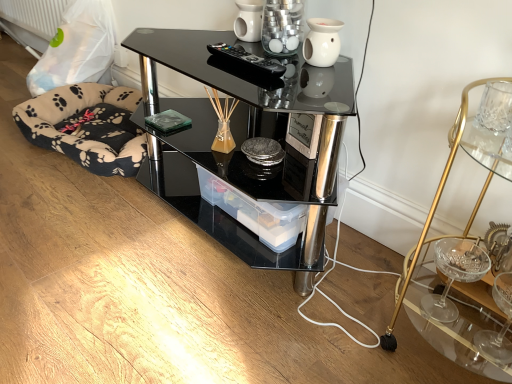
Measure the distance between white ceramic vase at upper center and camera.

1.06 meters.

What do you see at coordinates (322, 42) in the screenshot?
I see `white ceramic vase at upper center` at bounding box center [322, 42].

Describe the element at coordinates (246, 138) in the screenshot. The height and width of the screenshot is (384, 512). I see `black glass desk at center` at that location.

Where is `transparent plastic container at center`? This screenshot has height=384, width=512. transparent plastic container at center is located at coordinates (256, 212).

This screenshot has width=512, height=384. I want to click on black plastic remote at upper center, so click(246, 60).

Describe the element at coordinates (435, 203) in the screenshot. I see `gold metallic cocktail table at right` at that location.

Image resolution: width=512 pixels, height=384 pixels. I want to click on gold metallic cocktail table at right, so click(x=435, y=203).

Identify the location of white ceramic vase at upper center. (322, 42).

How many degrees apart are the facing directions of black glass desk at center and white ceramic candle holder at upper center?

The facing directions of black glass desk at center and white ceramic candle holder at upper center are 0.000256 degrees apart.

From the image's perspective, is black glass desk at center positioned above or below white ceramic candle holder at upper center?

Clearly, from the image's perspective, black glass desk at center is below white ceramic candle holder at upper center.

Between black glass desk at center and white ceramic candle holder at upper center, which one has larger size?

Bigger between the two is black glass desk at center.

Where is `cocktail table to the right of white ceramic vase at upper center`? This screenshot has width=512, height=384. cocktail table to the right of white ceramic vase at upper center is located at coordinates pos(435,203).

Is white ceramic vase at upper center aimed at gold metallic cocktail table at right?

No, white ceramic vase at upper center is not turned towards gold metallic cocktail table at right.

From a real-world perspective, which is physically above, white ceramic vase at upper center or gold metallic cocktail table at right?

In real-world perspective, white ceramic vase at upper center is above.

Which is in front, point (308, 53) or point (466, 341)?

The point (466, 341) is closer.

Relative to gold metallic cocktail table at right, is black fleece dog bed at lower left in front or behind?

Clearly, black fleece dog bed at lower left is behind gold metallic cocktail table at right.

From the image's perspective, is black fleece dog bed at lower left on top of gold metallic cocktail table at right?

Correct, black fleece dog bed at lower left appears higher than gold metallic cocktail table at right in the image.

Is black fleece dog bed at lower left touching gold metallic cocktail table at right?

black fleece dog bed at lower left and gold metallic cocktail table at right are clearly separated.

Measure the distance from black fleece dog bed at lower left to gold metallic cocktail table at right.

A distance of 1.29 meters exists between black fleece dog bed at lower left and gold metallic cocktail table at right.

Based on the photo, could you tell me if black fleece dog bed at lower left is facing white ceramic candle holder at upper center?

No, black fleece dog bed at lower left is not turned towards white ceramic candle holder at upper center.

Is the position of black fleece dog bed at lower left more distant than that of white ceramic candle holder at upper center?

Yes, black fleece dog bed at lower left is behind white ceramic candle holder at upper center.

Does point (84, 84) appear closer or farther from the camera than point (278, 20)?

Point (84, 84) is positioned farther from the camera compared to point (278, 20).

Is black plastic remote at upper center next to transparent plastic container at center and touching it?

No, black plastic remote at upper center is not with transparent plastic container at center.

From a real-world perspective, who is located higher, black plastic remote at upper center or transparent plastic container at center?

black plastic remote at upper center.

How many degrees apart are the facing directions of black plastic remote at upper center and transparent plastic container at center?

They differ by 3.82 degrees in their facing directions.

Identify the location of remote control below the white ceramic candle holder at upper center (from the image's perspective). (246, 60).

Considering the sizes of objects white ceramic candle holder at upper center and black plastic remote at upper center in the image provided, who is taller, white ceramic candle holder at upper center or black plastic remote at upper center?

white ceramic candle holder at upper center is taller.

Which object is positioned more to the right, white ceramic candle holder at upper center or black plastic remote at upper center?

white ceramic candle holder at upper center is more to the right.

Would you say white ceramic candle holder at upper center is outside black plastic remote at upper center?

Yes, white ceramic candle holder at upper center is located beyond the bounds of black plastic remote at upper center.

Can you tell me how much black fleece dog bed at lower left and white ceramic vase at upper center differ in facing direction?

They differ by 0.000732 degrees in their facing directions.

Where is `vase in front of the black fleece dog bed at lower left`? Image resolution: width=512 pixels, height=384 pixels. vase in front of the black fleece dog bed at lower left is located at coordinates (322, 42).

Do you think black fleece dog bed at lower left is within white ceramic vase at upper center, or outside of it?

black fleece dog bed at lower left is spatially situated outside white ceramic vase at upper center.

Is the surface of black fleece dog bed at lower left in direct contact with white ceramic vase at upper center?

No, black fleece dog bed at lower left is not in contact with white ceramic vase at upper center.

The image size is (512, 384). Find the location of `desk that appears below the white ceramic candle holder at upper center (from the image's perspective)`. desk that appears below the white ceramic candle holder at upper center (from the image's perspective) is located at coordinates (246, 138).

Locate an element on the screen. This screenshot has width=512, height=384. vase behind the gold metallic cocktail table at right is located at coordinates (322, 42).

Which object lies nearer to the anchor point black plastic remote at upper center, gold metallic cocktail table at right or black fleece dog bed at lower left?

gold metallic cocktail table at right lies closer to black plastic remote at upper center than the other object.

Considering their positions, is transparent plastic container at center positioned further to white ceramic candle holder at upper center than gold metallic cocktail table at right?

The object further to white ceramic candle holder at upper center is gold metallic cocktail table at right.

From the image, which object appears to be nearer to black glass desk at center, black fleece dog bed at lower left or white ceramic candle holder at upper center?

black fleece dog bed at lower left is positioned closer to the anchor black glass desk at center.

Based on their spatial positions, is white ceramic vase at upper center or black glass desk at center closer to black fleece dog bed at lower left?

Based on the image, black glass desk at center appears to be nearer to black fleece dog bed at lower left.

Based on their spatial positions, is black glass desk at center or black plastic remote at upper center further from white ceramic vase at upper center?

Based on the image, black glass desk at center appears to be further to white ceramic vase at upper center.

Which object lies nearer to the anchor point white ceramic candle holder at upper center, gold metallic cocktail table at right or white ceramic vase at upper center?

white ceramic vase at upper center.

Based on their spatial positions, is transparent plastic container at center or gold metallic cocktail table at right closer to black fleece dog bed at lower left?

Based on the image, transparent plastic container at center appears to be nearer to black fleece dog bed at lower left.

When comparing their distances from black plastic remote at upper center, does white ceramic candle holder at upper center or transparent plastic container at center seem closer?

Among the two, white ceramic candle holder at upper center is located nearer to black plastic remote at upper center.

Locate an element on the screen. This screenshot has width=512, height=384. remote control situated between black fleece dog bed at lower left and gold metallic cocktail table at right from left to right is located at coordinates (246, 60).

This screenshot has width=512, height=384. Identify the location of remote control between white ceramic vase at upper center and black glass desk at center in the vertical direction. (246, 60).

Locate an element on the screen. The image size is (512, 384). desk that lies between white ceramic vase at upper center and transparent plastic container at center from top to bottom is located at coordinates (246, 138).

This screenshot has width=512, height=384. Identify the location of remote control between black glass desk at center and gold metallic cocktail table at right from left to right. (246, 60).